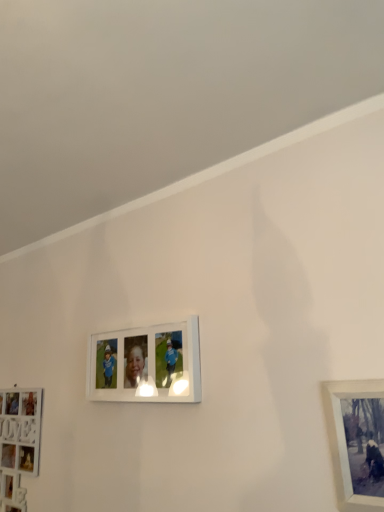
Question: In terms of size, does white matte picture frame at lower left, which is the 3th picture frame in right-to-left order, appear bigger or smaller than metallic silver frame at lower right, the 3th picture frame from the back?

Choices:
 (A) big
 (B) small

Answer: (A)

Question: Considering the positions of white matte picture frame at lower left, which appears as the first picture frame when viewed from the back, and metallic silver frame at lower right, the 3th picture frame from the back, in the image, is white matte picture frame at lower left, which appears as the first picture frame when viewed from the back, wider or thinner than metallic silver frame at lower right, the 3th picture frame from the back,?

Choices:
 (A) wide
 (B) thin

Answer: (A)

Question: Estimate the real-world distances between objects in this image. Which object is closer to the metallic silver frame at lower right, which appears as the first picture frame when viewed from the right?

Choices:
 (A) white glossy picture frame at center, which appears as the 2th picture frame when viewed from the back
 (B) white matte picture frame at lower left, which is the 3th picture frame in right-to-left order

Answer: (A)

Question: Estimate the real-world distances between objects in this image. Which object is farther from the white glossy picture frame at center, the 2th picture frame from the left?

Choices:
 (A) metallic silver frame at lower right, marked as the 1th picture frame in a front-to-back arrangement
 (B) white matte picture frame at lower left, the 3th picture frame from the front

Answer: (A)